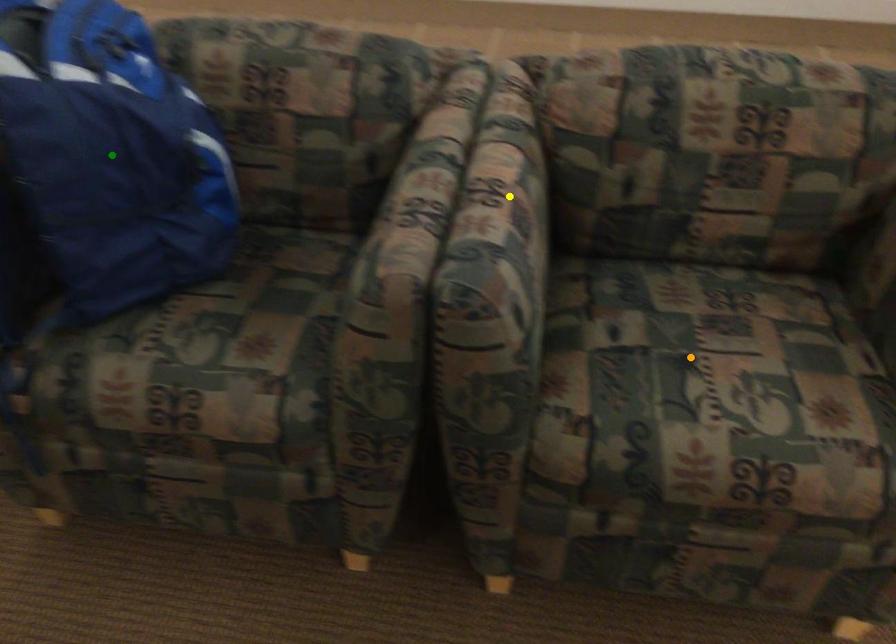
Order these from nearest to farthest:
A) green point
B) orange point
C) yellow point

green point
yellow point
orange point